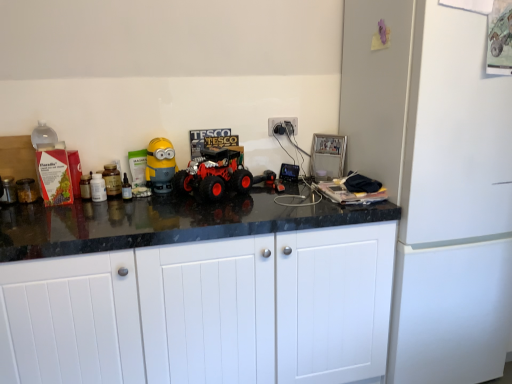
Find the location of a particular element. This screenshot has height=384, width=512. vacant area that is in front of rubberized black toy truck at center, which is counted as the 1th toy, starting from the right is located at coordinates (271, 198).